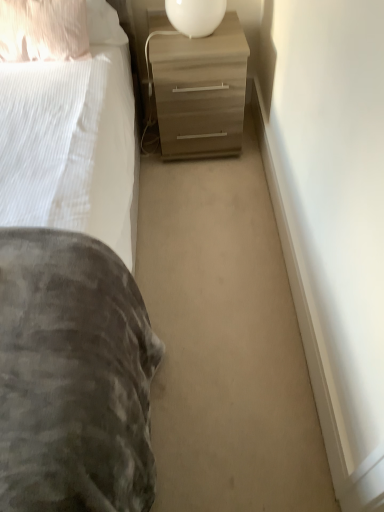
Locate an element on the screen. This screenshot has width=384, height=512. white glossy table lamp at upper center is located at coordinates pyautogui.click(x=195, y=16).

Measure the distance between point (x=164, y=132) and camera.

The distance of point (x=164, y=132) from camera is 6.37 feet.

At what (x,y) coordinates should I click in order to perform the action: click on matte wood chest of drawers at center. Please return your answer as a coordinate pair (x, y). The width and height of the screenshot is (384, 512). Looking at the image, I should click on (199, 88).

This screenshot has height=512, width=384. What are the coordinates of `white glossy table lamp at upper center` in the screenshot? It's located at (195, 16).

From the picture: Would you consider white glossy table lamp at upper center to be distant from pillow at upper left?

No, white glossy table lamp at upper center is not far from pillow at upper left.

Which object is positioned more to the right, white glossy table lamp at upper center or pillow at upper left?

Positioned to the right is white glossy table lamp at upper center.

Considering the positions of points (182, 23) and (18, 60), is point (182, 23) closer to camera compared to point (18, 60)?

Yes.

Consider the image. Which point is more forward, [216,27] or [211,81]?

Positioned in front is point [211,81].

Identify the location of the chest of drawers beneath the white glossy table lamp at upper center (from a real-world perspective). The height and width of the screenshot is (512, 384). (199, 88).

From a real-world perspective, which object rests below the other?

In real-world perspective, matte wood chest of drawers at center is lower.

Is white glossy table lamp at upper center taller or shorter than matte wood chest of drawers at center?

white glossy table lamp at upper center is shorter than matte wood chest of drawers at center.

Does matte wood chest of drawers at center have a greater width compared to white glossy table lamp at upper center?

Correct, the width of matte wood chest of drawers at center exceeds that of white glossy table lamp at upper center.

Can you tell me how much matte wood chest of drawers at center and white glossy table lamp at upper center differ in facing direction?

The angle between the facing direction of matte wood chest of drawers at center and the facing direction of white glossy table lamp at upper center is 0.00126 degrees.

Considering the relative sizes of matte wood chest of drawers at center and white glossy table lamp at upper center in the image provided, is matte wood chest of drawers at center shorter than white glossy table lamp at upper center?

Incorrect, the height of matte wood chest of drawers at center does not fall short of that of white glossy table lamp at upper center.

Is the depth of matte wood chest of drawers at center greater than that of white glossy table lamp at upper center?

Yes, it is behind white glossy table lamp at upper center.

How different are the orientations of pillow at upper left and white glossy table lamp at upper center in degrees?

A: 7.04 degrees.

Is pillow at upper left with white glossy table lamp at upper center?

There is a gap between pillow at upper left and white glossy table lamp at upper center.

Is pillow at upper left thinner than white glossy table lamp at upper center?

Correct, the width of pillow at upper left is less than that of white glossy table lamp at upper center.

Is matte wood chest of drawers at center to the left or to the right of pillow at upper left in the image?

matte wood chest of drawers at center is to the right of pillow at upper left.

Is matte wood chest of drawers at center touching pillow at upper left?

No, matte wood chest of drawers at center is not making contact with pillow at upper left.

How far apart are matte wood chest of drawers at center and pillow at upper left?

matte wood chest of drawers at center and pillow at upper left are 19.05 inches apart.

Considering the relative sizes of pillow at upper left and matte wood chest of drawers at center in the image provided, is pillow at upper left thinner than matte wood chest of drawers at center?

Indeed, pillow at upper left has a lesser width compared to matte wood chest of drawers at center.

From the image's perspective, between pillow at upper left and matte wood chest of drawers at center, who is located below?

matte wood chest of drawers at center is shown below in the image.

Are pillow at upper left and matte wood chest of drawers at center beside each other?

pillow at upper left and matte wood chest of drawers at center are clearly separated.

You are a GUI agent. You are given a task and a screenshot of the screen. Output one action in this format:
    pyautogui.click(x=<x>, y=<y>)
    Task: Click on the table lamp behind the pillow at upper left
    The width and height of the screenshot is (384, 512).
    Given the screenshot: What is the action you would take?
    pyautogui.click(x=195, y=16)

Locate an element on the screen. This screenshot has height=512, width=384. table lamp in front of the matte wood chest of drawers at center is located at coordinates (195, 16).

Estimate the real-world distances between objects in this image. Which object is further from matte wood chest of drawers at center, pillow at upper left or white glossy table lamp at upper center?

The object further to matte wood chest of drawers at center is pillow at upper left.

From the image, which object appears to be nearer to matte wood chest of drawers at center, white glossy table lamp at upper center or pillow at upper left?

The object closer to matte wood chest of drawers at center is white glossy table lamp at upper center.

Considering their positions, is matte wood chest of drawers at center positioned further to pillow at upper left than white glossy table lamp at upper center?

Based on the image, white glossy table lamp at upper center appears to be further to pillow at upper left.

Which object lies further to the anchor point white glossy table lamp at upper center, matte wood chest of drawers at center or pillow at upper left?

pillow at upper left is further to white glossy table lamp at upper center.

Looking at the image, which one is located further to pillow at upper left, white glossy table lamp at upper center or matte wood chest of drawers at center?

Among the two, white glossy table lamp at upper center is located further to pillow at upper left.

Looking at the image, which one is located closer to white glossy table lamp at upper center, pillow at upper left or matte wood chest of drawers at center?

matte wood chest of drawers at center.

You are a GUI agent. You are given a task and a screenshot of the screen. Output one action in this format:
    pyautogui.click(x=<x>, y=<y>)
    Task: Click on the table lamp situated between pillow at upper left and matte wood chest of drawers at center from left to right
    
    Given the screenshot: What is the action you would take?
    pyautogui.click(x=195, y=16)